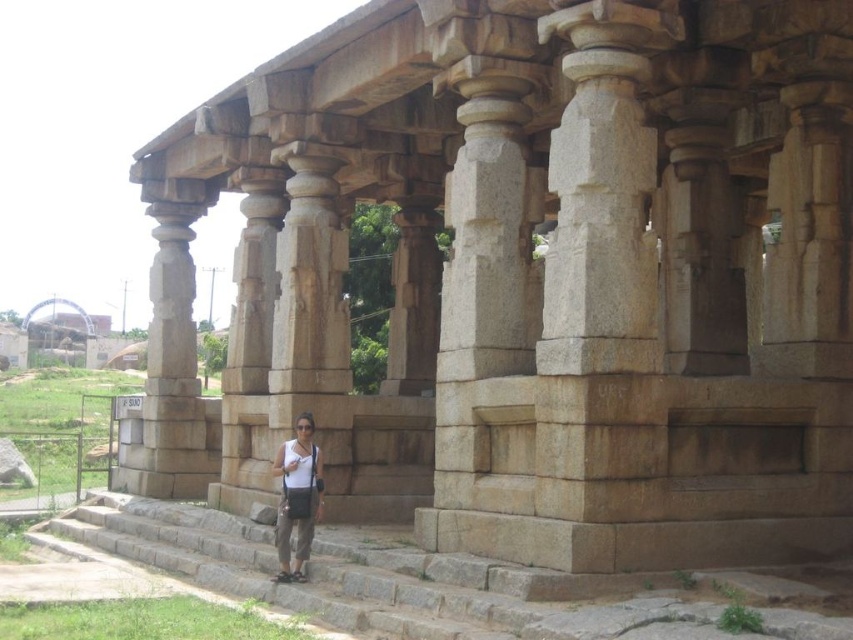
Question: Which point is closer to the camera taking this photo?

Choices:
 (A) (637, 628)
 (B) (292, 515)

Answer: (A)

Question: Can you confirm if brown stone stairs at center is wider than matte white shirt at center?

Choices:
 (A) yes
 (B) no

Answer: (A)

Question: Which object appears farthest from the camera in this image?

Choices:
 (A) matte white shirt at center
 (B) brown stone stairs at center

Answer: (A)

Question: Is brown stone stairs at center positioned at the back of matte white shirt at center?

Choices:
 (A) yes
 (B) no

Answer: (B)

Question: Which point appears farthest from the camera in this image?

Choices:
 (A) (305, 515)
 (B) (183, 557)

Answer: (B)

Question: Is brown stone stairs at center to the left of matte white shirt at center from the viewer's perspective?

Choices:
 (A) yes
 (B) no

Answer: (A)